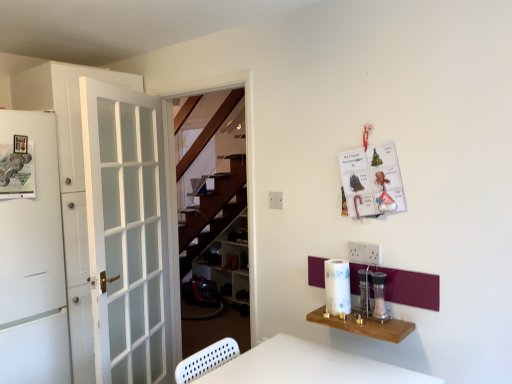
This screenshot has height=384, width=512. Find the location of `empty space that is ontop of wooden shelf at lower right (from a real-world perspective)`. empty space that is ontop of wooden shelf at lower right (from a real-world perspective) is located at coordinates (370, 319).